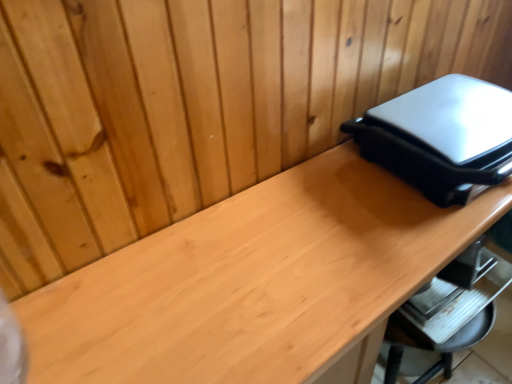
Question: Is point (387, 115) closer or farther from the camera than point (256, 304)?

Choices:
 (A) farther
 (B) closer

Answer: (A)

Question: Based on their sizes in the image, would you say satin black appliance at upper right is bigger or smaller than matte wood desk at right?

Choices:
 (A) small
 (B) big

Answer: (A)

Question: In terms of height, does satin black appliance at upper right look taller or shorter compared to matte wood desk at right?

Choices:
 (A) short
 (B) tall

Answer: (A)

Question: Is point (434, 213) positioned closer to the camera than point (444, 153)?

Choices:
 (A) farther
 (B) closer

Answer: (A)

Question: Do you think matte wood desk at right is within satin black appliance at upper right, or outside of it?

Choices:
 (A) inside
 (B) outside

Answer: (B)

Question: From a real-world perspective, is matte wood desk at right above or below satin black appliance at upper right?

Choices:
 (A) above
 (B) below

Answer: (B)

Question: Is matte wood desk at right wider or thinner than satin black appliance at upper right?

Choices:
 (A) wide
 (B) thin

Answer: (A)